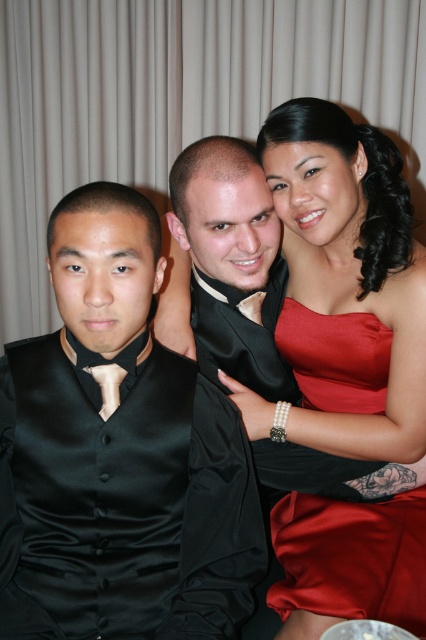
Looking at this image, you are a photographer adjusting the camera focus. You notice the black satin vest at left and the matte black tie at left in your frame. Which object should you focus on first if you want to ensure both are in focus, considering their positions?

The black satin vest at left is taller than the matte black tie at left, so focusing on the black satin vest at left first will help ensure both are in focus since it is larger in the frame.

You are taking a photo of three people standing in a straight line. You notice two specific points marked in the image. The first point is at coordinate point (43, 506) and the second is at point (397, 534). If you want to focus your camera on the point that is closer to you, which coordinate should you choose?

You should focus on point (43, 506) because it is closer to the camera than point (397, 534).

You are a photographer adjusting the lighting for a group photo. You need to ensure that the shiny satin dress at upper right and the matte black tie at left are both well lit. Considering their material properties, which object might require more direct light to appear properly illuminated in the final photo?

The shiny satin dress at upper right might require more direct light because it is bigger and its reflective material can cast highlights more prominently, ensuring it stands out in the photo.